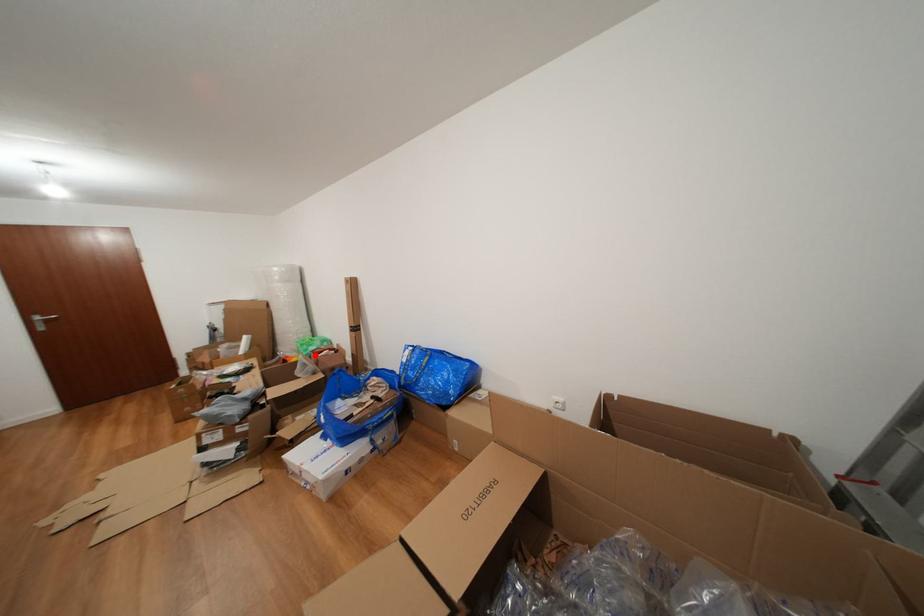
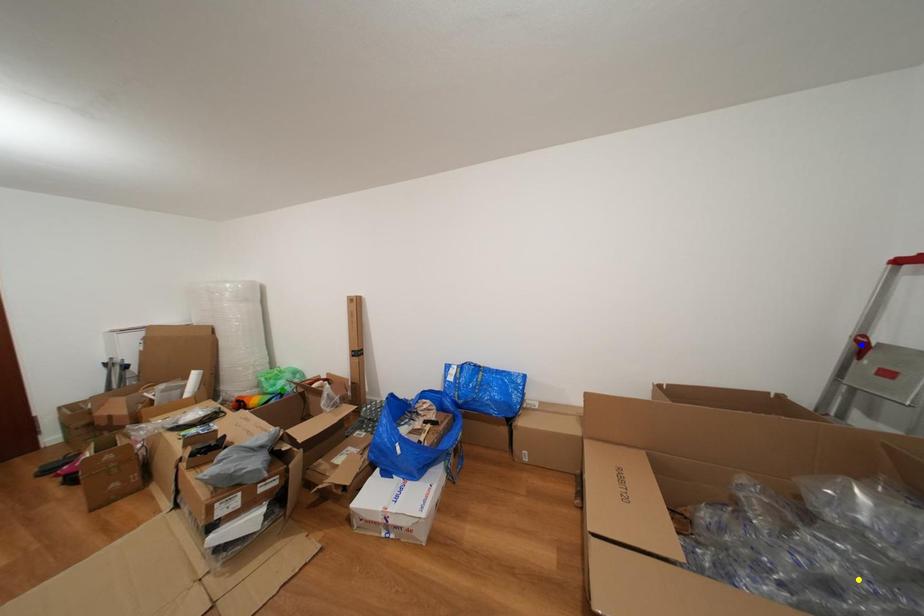
Question: I am providing you with two images of the same scene from different viewpoints. A red point is marked on the first image. You are given multiple points on the second image. In image 2, which mark is for the same physical point as the one in image 1?

Choices:
 (A) yellow point
 (B) blue point
 (C) green point

Answer: (C)